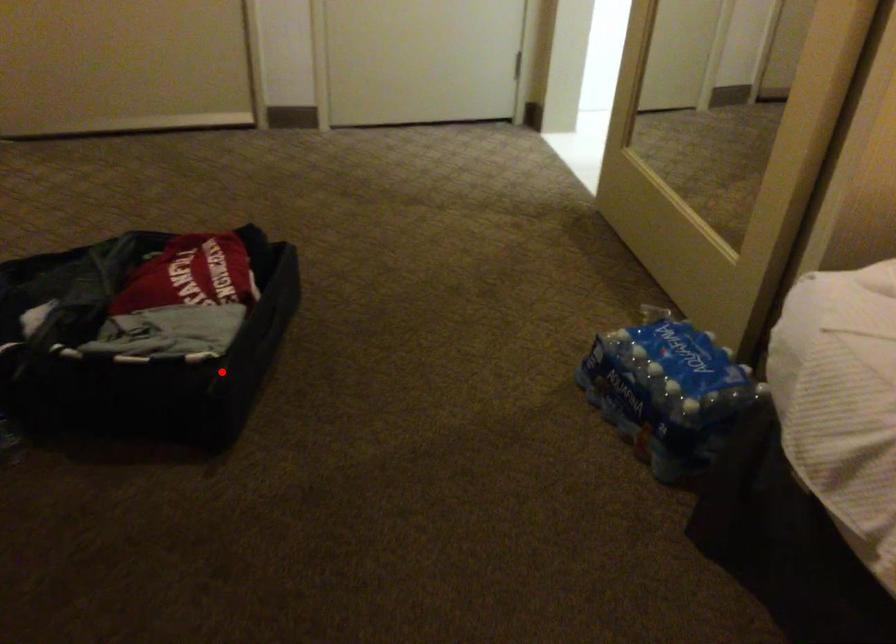
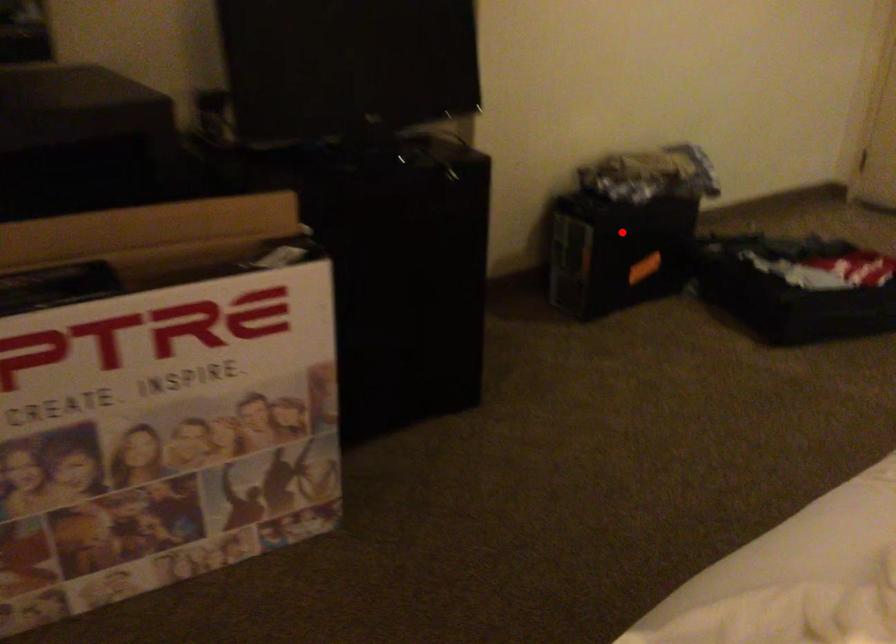
I am providing you with two images of the same scene from different viewpoints. A red point is marked on the first image and another point is marked on the second image. Does the point marked in image1 correspond to the same location as the one in image2?

No